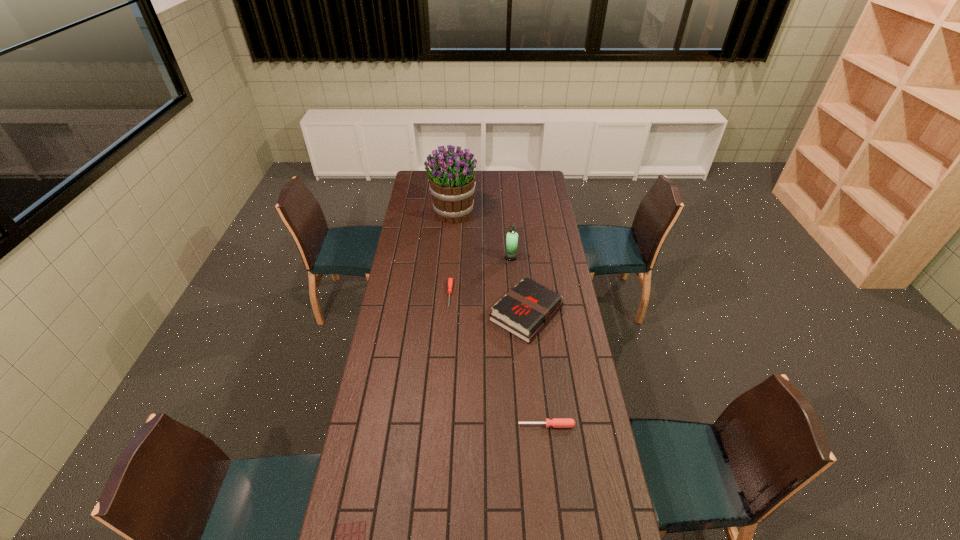
This screenshot has height=540, width=960. I want to click on free spot between the thermos bottle and the bouquet, so click(x=482, y=235).

At what (x,y) coordinates should I click in order to perform the action: click on unoccupied position between the thermos bottle and the bouquet. Please return your answer as a coordinate pair (x, y). The width and height of the screenshot is (960, 540). Looking at the image, I should click on (482, 235).

Where is `empty space that is in between the right screwdriver and the fifth tallest object`? empty space that is in between the right screwdriver and the fifth tallest object is located at coordinates (498, 360).

The width and height of the screenshot is (960, 540). What are the coordinates of `blank region between the thermos bottle and the tallest object` in the screenshot? It's located at (482, 235).

This screenshot has width=960, height=540. Find the location of `vacant area that lies between the bouquet and the farther screwdriver`. vacant area that lies between the bouquet and the farther screwdriver is located at coordinates (451, 253).

Find the location of `object that is the fifth closest to the leftmost object`. object that is the fifth closest to the leftmost object is located at coordinates (452, 181).

Locate which object is the third closest to the nearest object. Please provide its 2D coordinates. Your answer should be formatted as a tuple, i.e. [(x, y)], where the tuple contains the x and y coordinates of a point satisfying the conditions above.

[(450, 280)]

Identify the location of vacant space that satisfies the following two spatial constraints: 1. on the front side of the second nearest object; 2. on the left side of the bouquet. The height and width of the screenshot is (540, 960). (437, 425).

The height and width of the screenshot is (540, 960). In order to click on free location that satisfies the following two spatial constraints: 1. at the tip of the third shortest object; 2. on the right side of the shorter screwdriver in this screenshot , I will do `click(441, 425)`.

At what (x,y) coordinates should I click in order to perform the action: click on free spot that satisfies the following two spatial constraints: 1. at the tip of the fourth shortest object; 2. on the right side of the farther screwdriver. Please return your answer as a coordinate pair (x, y). Image resolution: width=960 pixels, height=540 pixels. Looking at the image, I should click on (448, 314).